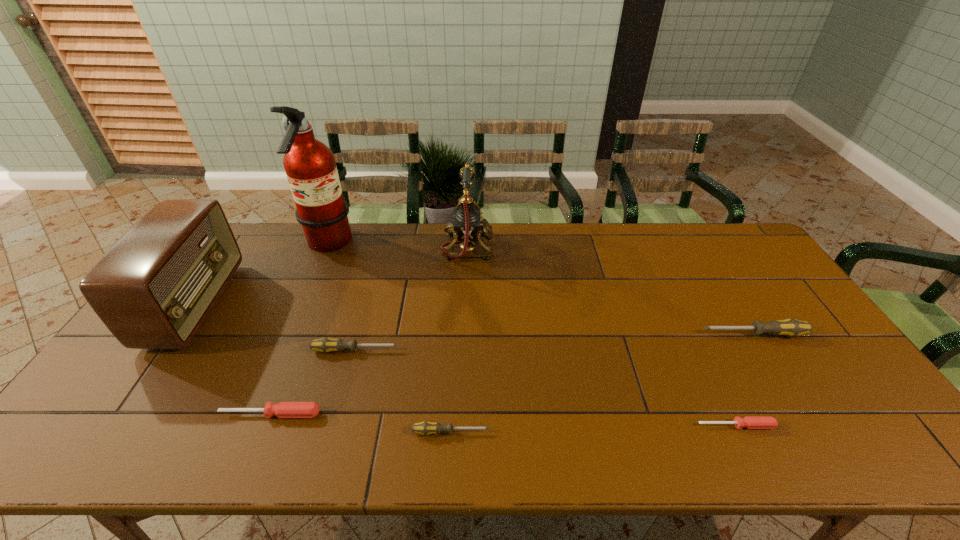
Locate an element on the screen. The image size is (960, 540). free space located 0.290m on the left of the farther red screwdriver is located at coordinates (99, 414).

The image size is (960, 540). What are the coordinates of `free point located 0.120m at the tip of the smallest gray screwdriver` in the screenshot? It's located at (541, 432).

The image size is (960, 540). What are the coordinates of `vacant position located 0.110m on the right of the shortest screwdriver` in the screenshot? It's located at [x=822, y=426].

This screenshot has width=960, height=540. I want to click on fire extinguisher that is at the far edge, so click(x=310, y=166).

This screenshot has width=960, height=540. I want to click on telephone at the far edge, so click(467, 224).

This screenshot has height=540, width=960. I want to click on radio receiver present at the far edge, so click(153, 289).

Locate an element on the screen. object at the left edge is located at coordinates (153, 289).

Find the location of a particular element. This screenshot has width=960, height=540. object positioned at the right edge is located at coordinates (790, 327).

Locate an element on the screen. object positioned at the far left corner is located at coordinates (153, 289).

You are a GUI agent. You are given a task and a screenshot of the screen. Output one action in this format:
    pyautogui.click(x=<x>, y=<y>)
    Task: Click on the free space at the far edge of the desktop
    Image resolution: width=960 pixels, height=540 pixels.
    Given the screenshot: What is the action you would take?
    pyautogui.click(x=360, y=241)